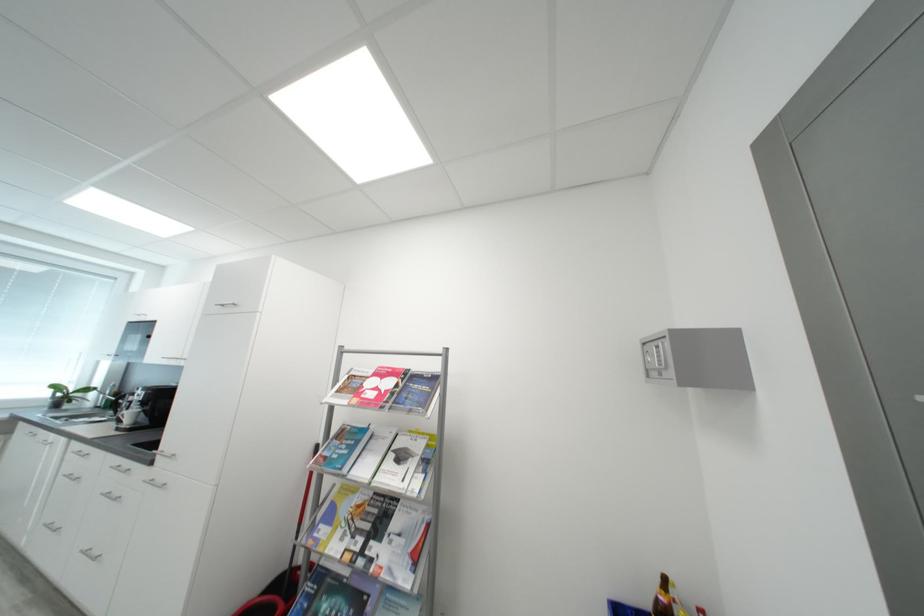
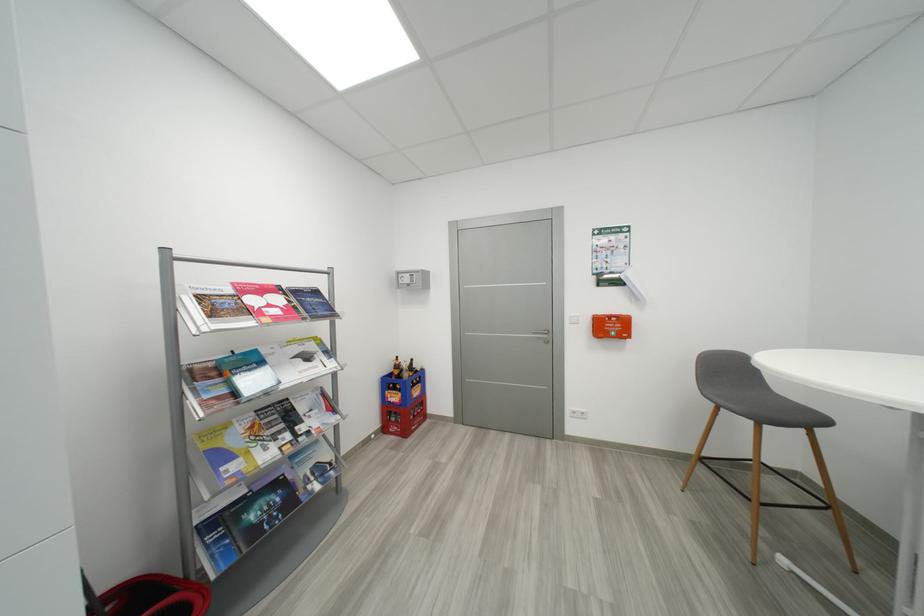
In the second image, find the point that corresponds to pixel 407 459 in the first image.

(314, 359)